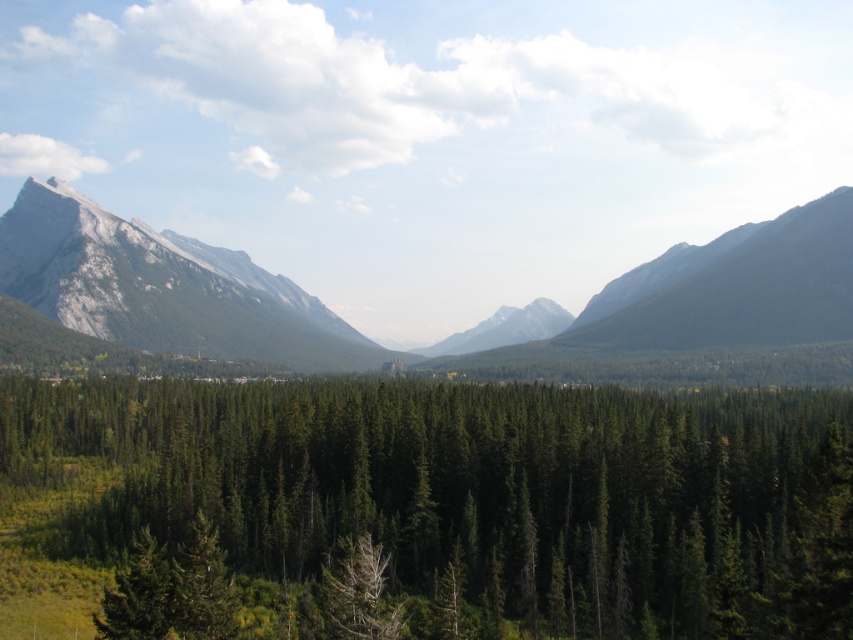
Question: Is rugged granite mountain range at left to the right of dark gray rocky mountain at upper right from the viewer's perspective?

Choices:
 (A) no
 (B) yes

Answer: (A)

Question: Which point is farther from the camera taking this photo?

Choices:
 (A) (786, 301)
 (B) (51, 192)
 (C) (563, 467)

Answer: (B)

Question: Which object is the closest to the dark gray rocky mountain at upper right?

Choices:
 (A) green matte tree at center
 (B) rugged granite mountain range at left

Answer: (B)

Question: Among these objects, which one is nearest to the camera?

Choices:
 (A) rugged granite mountain range at left
 (B) green matte forest at center
 (C) green matte tree at center
 (D) rugged stone mountain at left

Answer: (B)

Question: Does dark gray rocky mountain at upper right appear on the right side of green matte tree at center?

Choices:
 (A) no
 (B) yes

Answer: (B)

Question: Does rugged granite mountain range at left come behind green matte tree at center?

Choices:
 (A) yes
 (B) no

Answer: (A)